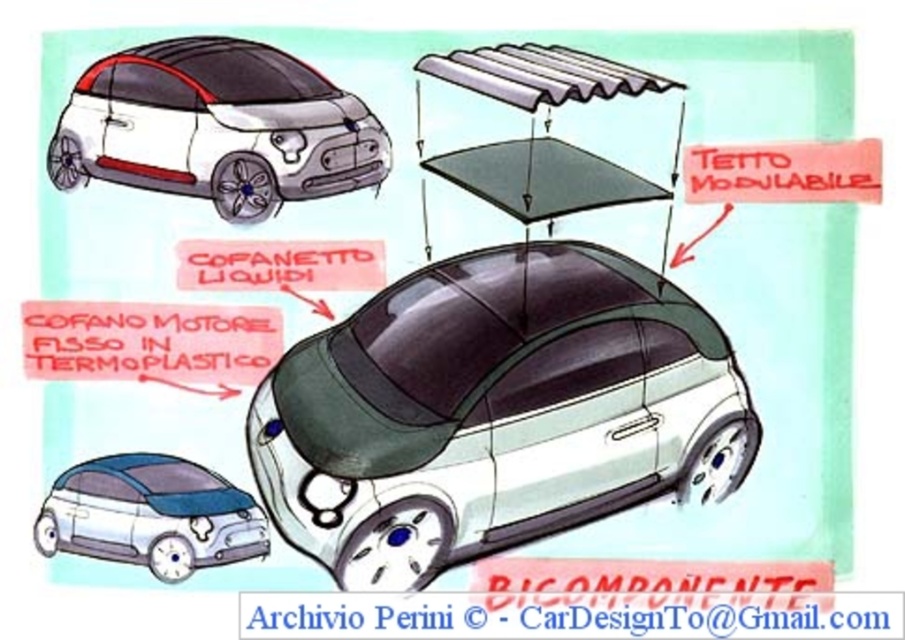
Question: Estimate the real-world distances between objects in this image. Which object is closer to the green matte car at center?

Choices:
 (A) matte blue car at lower left
 (B) white matte car at upper left

Answer: (A)

Question: Estimate the real-world distances between objects in this image. Which object is farther from the green matte car at center?

Choices:
 (A) matte blue car at lower left
 (B) white matte car at upper left

Answer: (B)

Question: Which point is farther to the camera?

Choices:
 (A) (397, 304)
 (B) (282, 96)
 (C) (240, 490)

Answer: (A)

Question: Does white matte car at upper left lie behind matte blue car at lower left?

Choices:
 (A) yes
 (B) no

Answer: (A)

Question: Can you confirm if green matte car at center is wider than matte blue car at lower left?

Choices:
 (A) no
 (B) yes

Answer: (B)

Question: Is green matte car at center further to the viewer compared to white matte car at upper left?

Choices:
 (A) yes
 (B) no

Answer: (A)